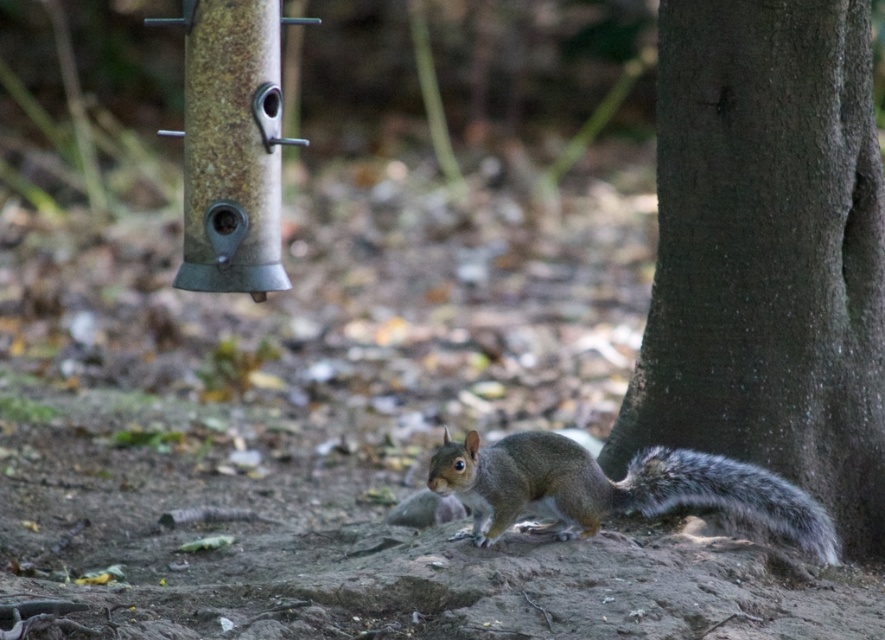
You are a photographer trying to capture the gray fur squirrel at center and the dark brown textured tree trunk at right in the same frame. Based on their positions, which object is higher up in the image?

The dark brown textured tree trunk at right is located above the gray fur squirrel at center, so it is higher up in the image.

You are a photographer standing at the center of the frame. You want to take a photo of the dark brown textured tree trunk at right. Where should you point your camera to capture it in the frame?

You should point your camera towards the coordinates at point 0.395 on the horizontal axis and 0.868 on the vertical axis to capture the dark brown textured tree trunk at right.

You are a small animal trying to hide behind the dark brown textured tree trunk at right and the gray furry tail at lower right. Which object would provide better coverage for hiding?

The dark brown textured tree trunk at right is bigger than the gray furry tail at lower right, so it would provide better coverage for hiding.